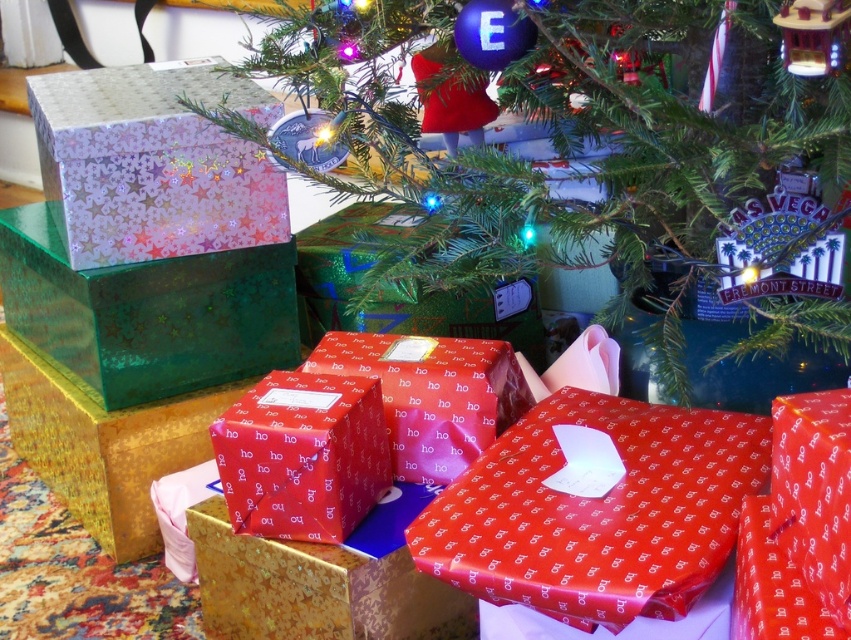
You are a child who just received a gift. You are standing 10 inches away from the shiny red wrapping paper at center and 10 inches away from the shiny green wrapping paper at center. Can you reach both gifts without moving your feet?

The shiny red wrapping paper at center is 16.58 inches away from the shiny green wrapping paper at center. Since you are standing 10 inches away from both, the distance between the two gifts is greater than the space you can cover without moving, so you cannot reach both without moving your feet.

You are a child who wants to choose a gift to open first. You see two gifts with shiny red wrapping paper at center and shiny green wrapping paper at center. Which gift takes up more space in the pile?

The shiny green wrapping paper at center occupies more space than the shiny red wrapping paper at center, so the gift with shiny green wrapping paper at center takes up more space in the pile.

You are a child who just arrived at the Christmas tree and wants to pick up a gift. You see the shiny red wrapping paper at center and the shiny green wrapping paper at center. Which gift should you choose to grab first if you want the one that is closer to you?

The shiny red wrapping paper at center is closer to you because it is in front of the shiny green wrapping paper at center, so you should grab the shiny red wrapping paper at center first.